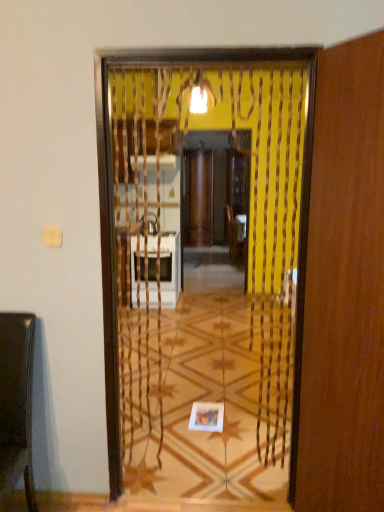
Question: Is shiny brown chair at left shorter than wooden screen door at center, acting as the 1th screen door starting from the back?

Choices:
 (A) yes
 (B) no

Answer: (A)

Question: Is wooden screen door at center, the 2th screen door when ordered from front to back, surrounded by shiny brown chair at left?

Choices:
 (A) yes
 (B) no

Answer: (B)

Question: Is shiny brown chair at left at the right side of wooden screen door at center, the 2th screen door when ordered from front to back?

Choices:
 (A) yes
 (B) no

Answer: (B)

Question: From the image's perspective, is shiny brown chair at left below wooden screen door at center, the 2th screen door when ordered from front to back?

Choices:
 (A) yes
 (B) no

Answer: (A)

Question: Considering the relative positions of shiny brown chair at left and wooden screen door at center, the 2th screen door when ordered from front to back, in the image provided, is shiny brown chair at left behind wooden screen door at center, the 2th screen door when ordered from front to back,?

Choices:
 (A) yes
 (B) no

Answer: (B)

Question: Is wooden screen door at right, which is the 1th screen door from front to back, in front of or behind shiny brown chair at left in the image?

Choices:
 (A) front
 (B) behind

Answer: (A)

Question: Looking at their shapes, would you say wooden screen door at right, positioned as the second screen door in back-to-front order, is wider or thinner than shiny brown chair at left?

Choices:
 (A) thin
 (B) wide

Answer: (A)

Question: Which is correct: wooden screen door at right, positioned as the second screen door in back-to-front order, is inside shiny brown chair at left, or outside of it?

Choices:
 (A) outside
 (B) inside

Answer: (A)

Question: Considering the positions of point (314, 242) and point (8, 412), is point (314, 242) closer or farther from the camera than point (8, 412)?

Choices:
 (A) closer
 (B) farther

Answer: (A)

Question: Considering their positions, is wooden screen door at right, which is the 1th screen door from front to back, located in front of or behind wooden screen door at center, the 2th screen door when ordered from front to back?

Choices:
 (A) front
 (B) behind

Answer: (A)

Question: Considering the positions of point (309, 421) and point (236, 209), is point (309, 421) closer or farther from the camera than point (236, 209)?

Choices:
 (A) closer
 (B) farther

Answer: (A)

Question: From a real-world perspective, is wooden screen door at right, positioned as the second screen door in back-to-front order, physically located above or below wooden screen door at center, the 2th screen door when ordered from front to back?

Choices:
 (A) below
 (B) above

Answer: (A)

Question: Based on their sizes in the image, would you say wooden screen door at right, positioned as the second screen door in back-to-front order, is bigger or smaller than wooden screen door at center, the 2th screen door when ordered from front to back?

Choices:
 (A) big
 (B) small

Answer: (B)

Question: Is wooden screen door at center, acting as the 1th screen door starting from the back, taller or shorter than shiny brown chair at left?

Choices:
 (A) short
 (B) tall

Answer: (B)

Question: Is wooden screen door at center, acting as the 1th screen door starting from the back, bigger or smaller than shiny brown chair at left?

Choices:
 (A) small
 (B) big

Answer: (B)